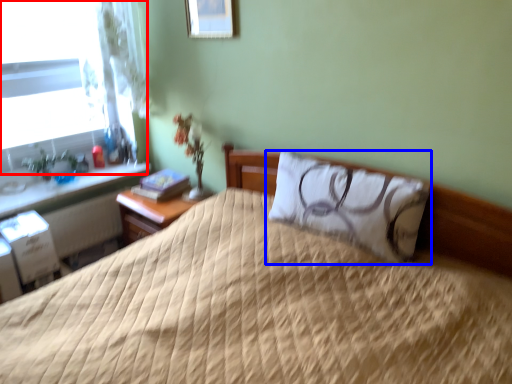
Question: Which of the following is the closest to the observer, window (highlighted by a red box) or pillow (highlighted by a blue box)?

Choices:
 (A) window
 (B) pillow

Answer: (B)